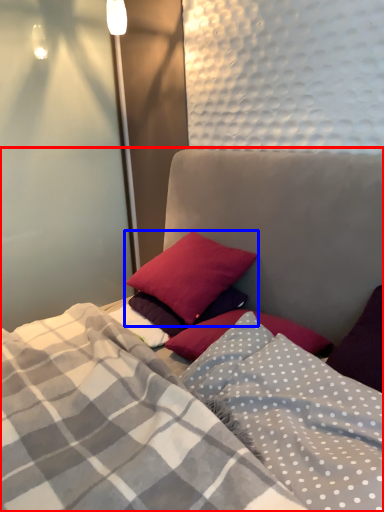
Question: Among these objects, which one is nearest to the camera, bed (highlighted by a red box) or pillow (highlighted by a blue box)?

Choices:
 (A) bed
 (B) pillow

Answer: (A)